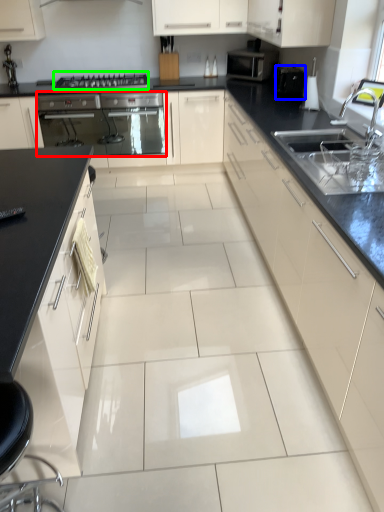
Question: Estimate the real-world distances between objects in this image. Which object is farther from home appliance (highlighted by a red box), appliance (highlighted by a blue box) or gas stove (highlighted by a green box)?

Choices:
 (A) appliance
 (B) gas stove

Answer: (A)